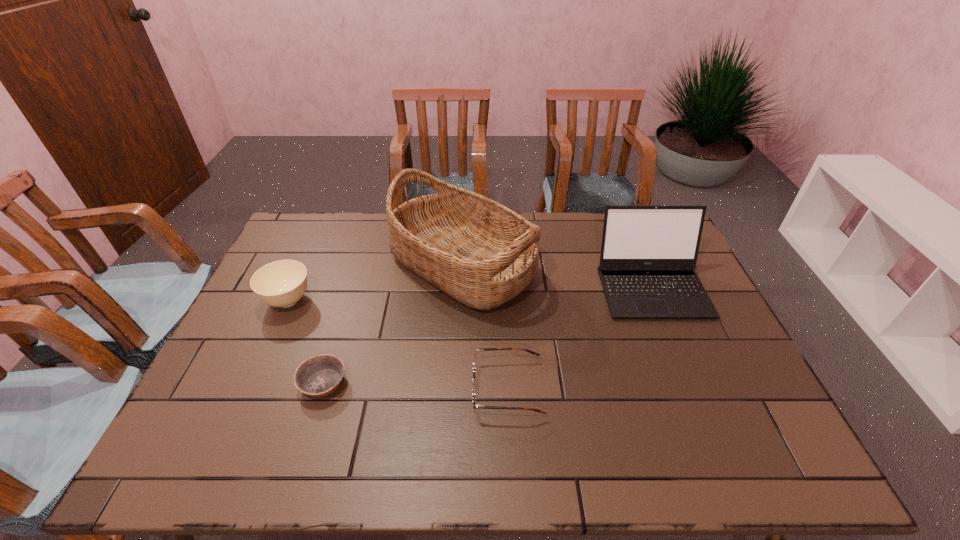
Locate an element on the screen. This screenshot has height=540, width=960. vacant space at the left edge of the desktop is located at coordinates click(x=213, y=417).

This screenshot has width=960, height=540. Identify the location of free space at the right edge of the desktop. (747, 388).

In the image, there is a desktop. Where is `free space at the far left corner`? This screenshot has height=540, width=960. free space at the far left corner is located at coordinates (301, 226).

I want to click on free point between the tallest object and the laptop, so coord(557,276).

Locate an element on the screen. free space between the second shortest object and the second tallest object is located at coordinates (580, 338).

Locate an element on the screen. This screenshot has height=540, width=960. vacant space that is in between the bowl and the rightmost object is located at coordinates (488, 335).

Locate an element on the screen. This screenshot has width=960, height=540. unoccupied area between the shortest object and the spectacles is located at coordinates (416, 386).

Locate an element on the screen. The height and width of the screenshot is (540, 960). free space between the rightmost object and the fourth tallest object is located at coordinates (580, 338).

Where is `vacant space that is in between the rightmost object and the fourth object from right to left`? Image resolution: width=960 pixels, height=540 pixels. vacant space that is in between the rightmost object and the fourth object from right to left is located at coordinates (488, 335).

I want to click on free spot between the sugar bowl and the shortest object, so click(x=305, y=342).